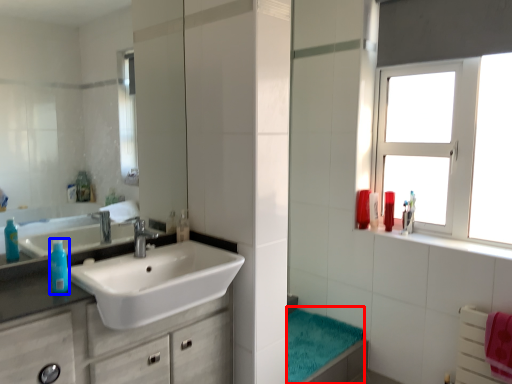
Question: Which point is further to the camera, bath towel (highlighted by a red box) or turquoise (highlighted by a blue box)?

Choices:
 (A) bath towel
 (B) turquoise

Answer: (A)